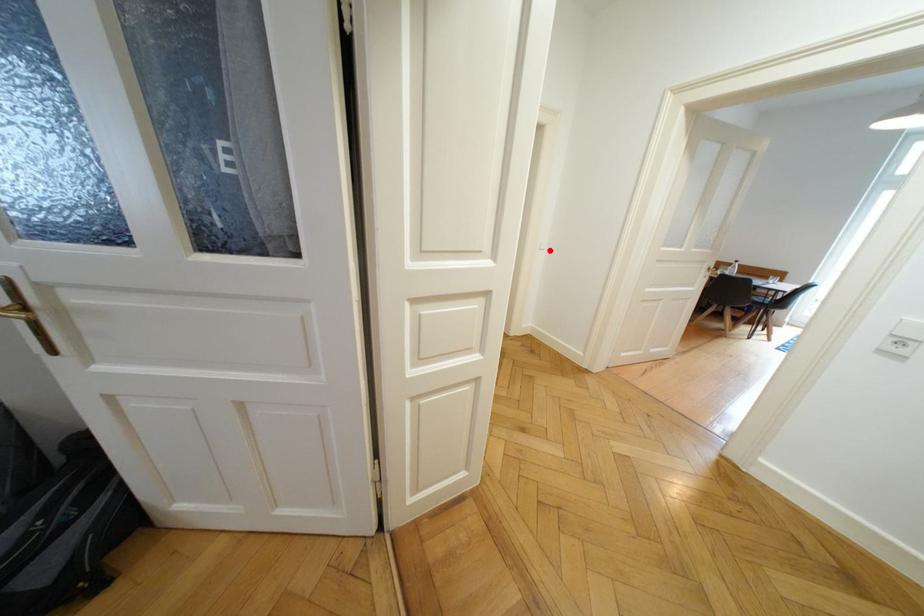
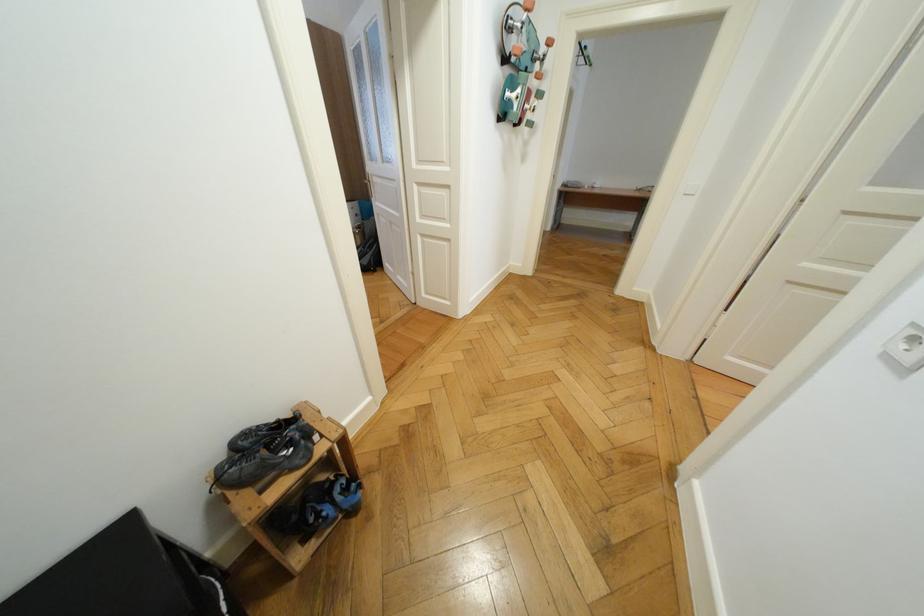
Find the pixel in the second image that matches the highlighted location in the first image.

(695, 196)